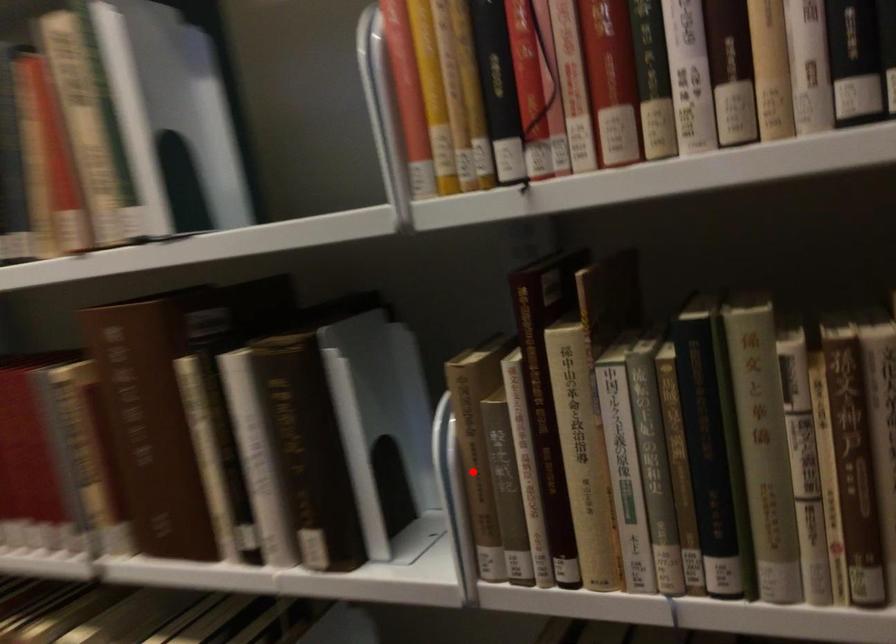
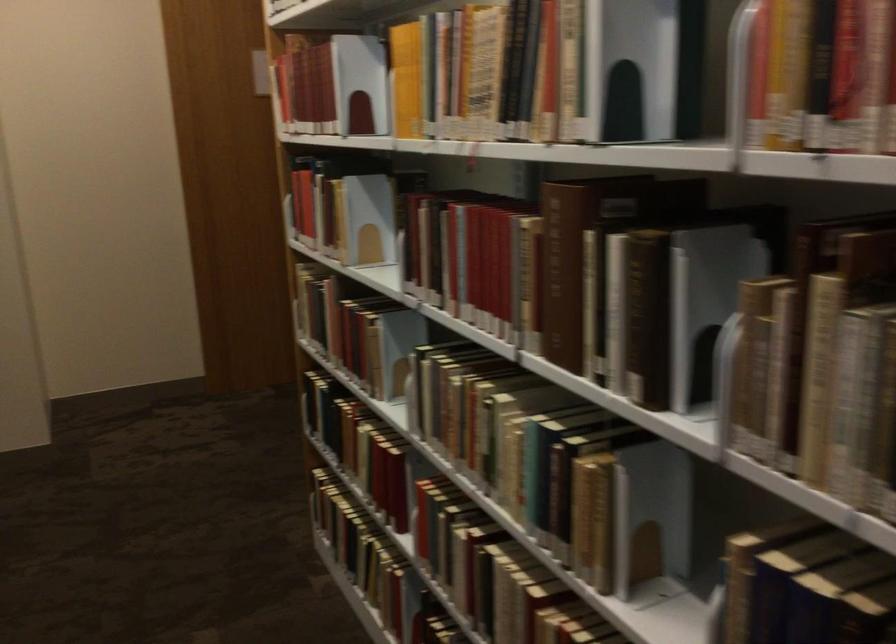
Question: I am providing you with two images of the same scene from different viewpoints. In image1, a red point is highlighted. Considering the same 3D point in image2, which of the following is correct?

Choices:
 (A) It is closer
 (B) It is farther

Answer: (B)